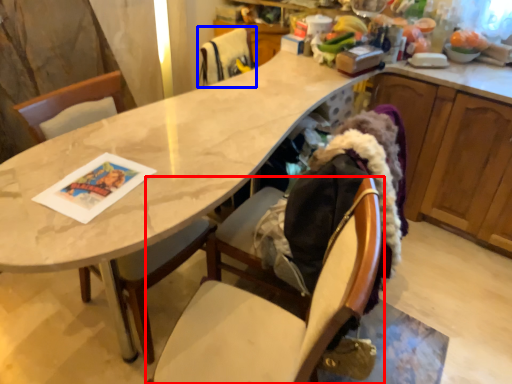
Question: Among these objects, which one is nearest to the camera, chair (highlighted by a red box) or chair (highlighted by a blue box)?

Choices:
 (A) chair
 (B) chair

Answer: (A)